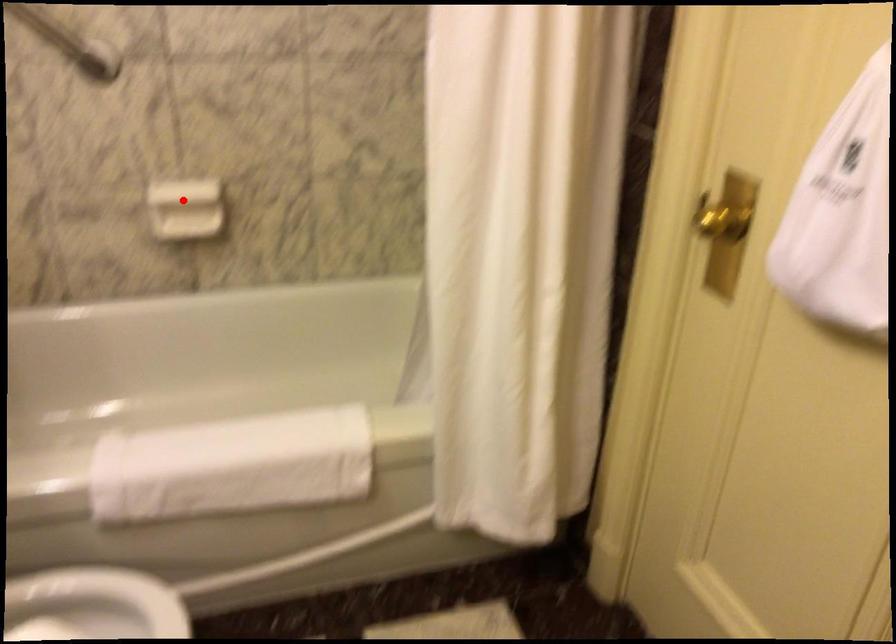
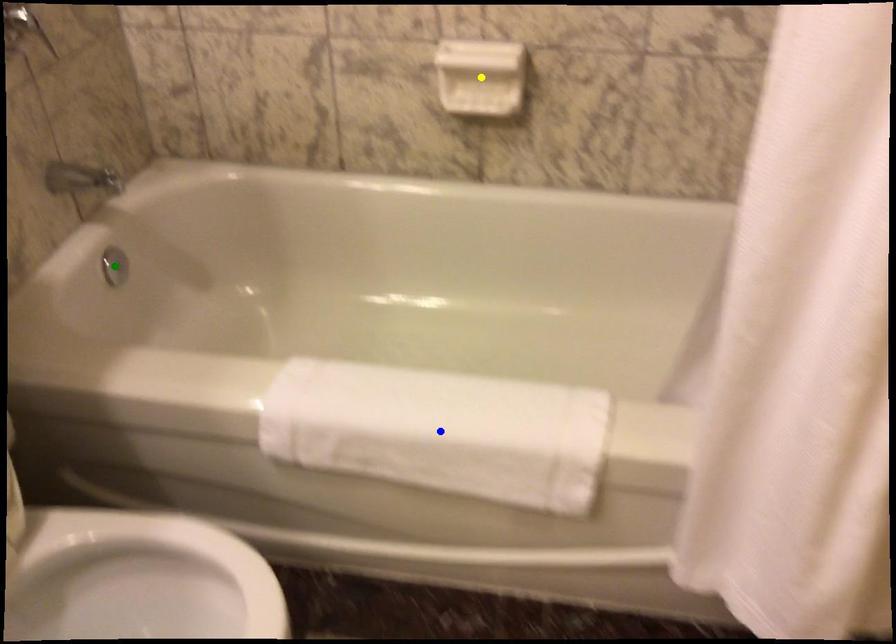
Question: I am providing you with two images of the same scene from different viewpoints. A red point is marked on the first image. You are given multiple points on the second image. In image 2, which mark is for the same physical point as the one in image 1?

Choices:
 (A) yellow point
 (B) blue point
 (C) green point

Answer: (A)